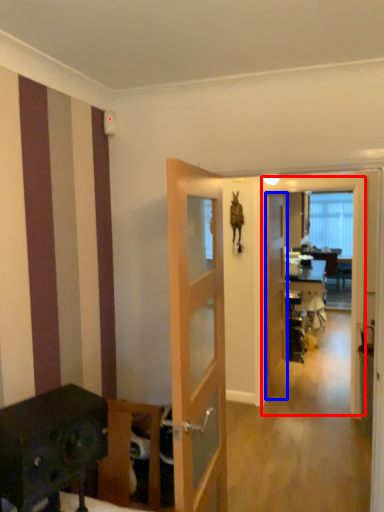
Question: Among these objects, which one is farthest to the camera, screen door (highlighted by a red box) or door (highlighted by a blue box)?

Choices:
 (A) screen door
 (B) door

Answer: (B)